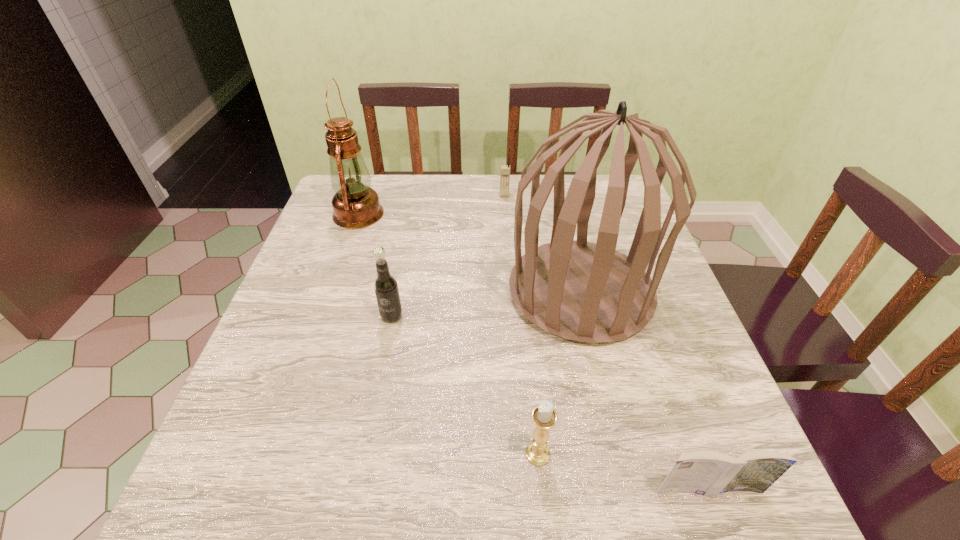
Locate an element on the screen. vacant area situated on the front of the leftmost object is located at coordinates (328, 299).

At what (x,y) coordinates should I click in order to perform the action: click on free region located 0.050m on the label of the second object from left to right. Please return your answer as a coordinate pair (x, y). Looking at the image, I should click on (387, 343).

The image size is (960, 540). What are the coordinates of `free space located on the front of the cellular telephone, where the keypad is located` in the screenshot? It's located at (506, 213).

Where is `free space located on the right of the candle holder`? free space located on the right of the candle holder is located at coordinates (739, 454).

You are a GUI agent. You are given a task and a screenshot of the screen. Output one action in this format:
    pyautogui.click(x=<x>, y=<y>)
    Task: Click on the oil lamp that is positioned at the far edge
    The height and width of the screenshot is (540, 960).
    Given the screenshot: What is the action you would take?
    pyautogui.click(x=355, y=205)

You are a GUI agent. You are given a task and a screenshot of the screen. Output one action in this format:
    pyautogui.click(x=<x>, y=<y>)
    Task: Click on the cellular telephone situated at the far edge
    Image resolution: width=960 pixels, height=540 pixels.
    Given the screenshot: What is the action you would take?
    pyautogui.click(x=505, y=169)

This screenshot has height=540, width=960. Identify the location of candle holder located in the near edge section of the desktop. (544, 417).

Find the location of a particular element. book that is positioned at the near edge is located at coordinates (708, 473).

At what (x,y) coordinates should I click in order to perform the action: click on object located in the left edge section of the desktop. Please return your answer as a coordinate pair (x, y). The width and height of the screenshot is (960, 540). Looking at the image, I should click on coord(355,205).

Identify the location of birdcage at the right edge. (589, 292).